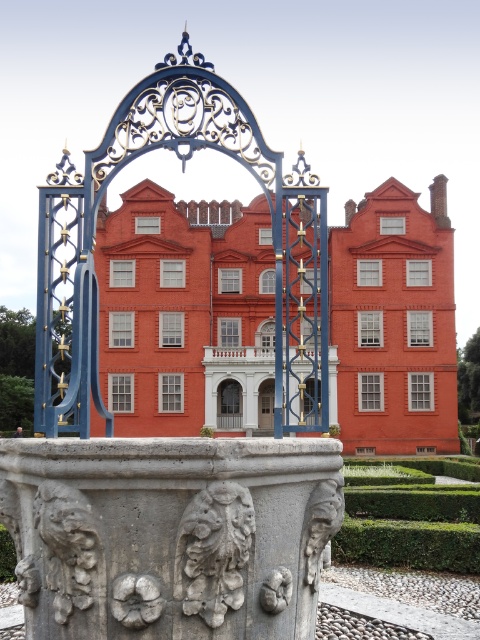
You are a delivery person trying to enter the building through the matte glass door at center. The gray stone pillar at center might block your path. Can you walk through the space between them?

The gray stone pillar at center is located above the matte glass door at center, so there is no obstruction blocking the path to the matte glass door at center. You can walk through the space between them.

You are a visitor approaching the ornate metal gate. You notice the gray stone pillar at center and the green leafy hedge at lower right. Which of these two objects is shorter?

The gray stone pillar at center has a lesser height compared to the green leafy hedge at lower right, so the gray stone pillar at center is shorter.

You are standing in front of the grand red building and want to walk towards the gray stone pillar at center and the white stone carving at center. Which object will you encounter first?

The gray stone pillar at center is closer to you than the white stone carving at center, so you will encounter the gray stone pillar at center first.